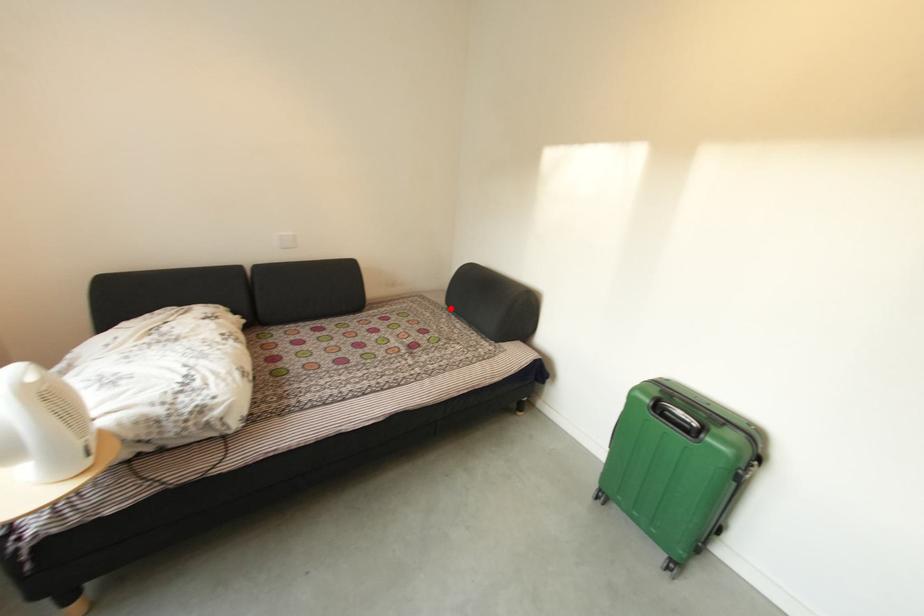
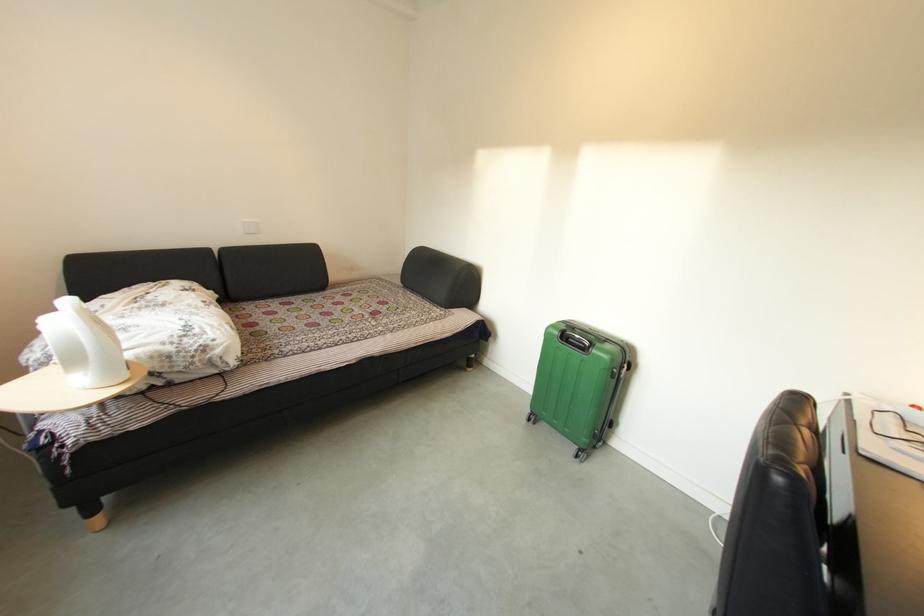
Question: I am providing you with two images of the same scene from different viewpoints. A red point is marked on the first image. Can you still see the location of the red point in image 2?

Choices:
 (A) Yes
 (B) No

Answer: (A)